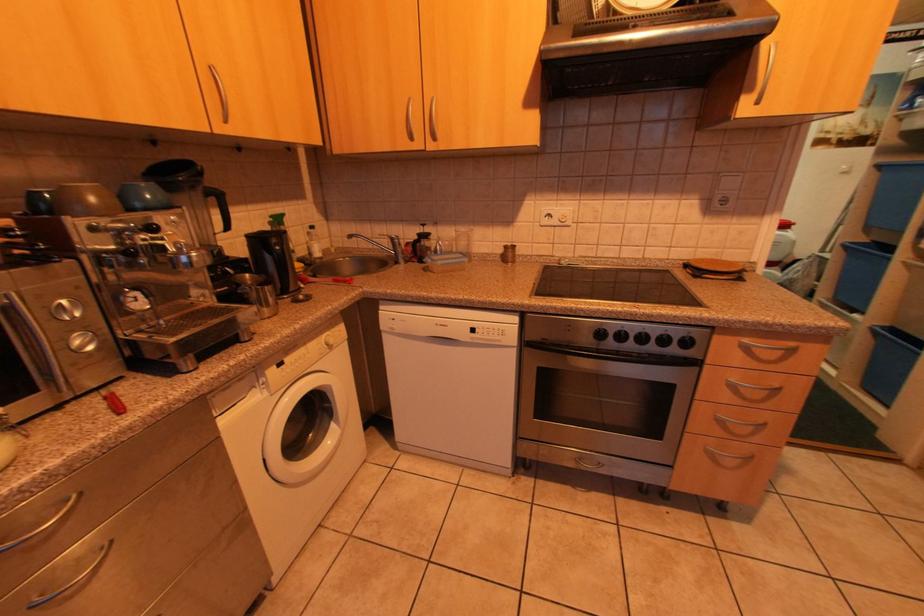
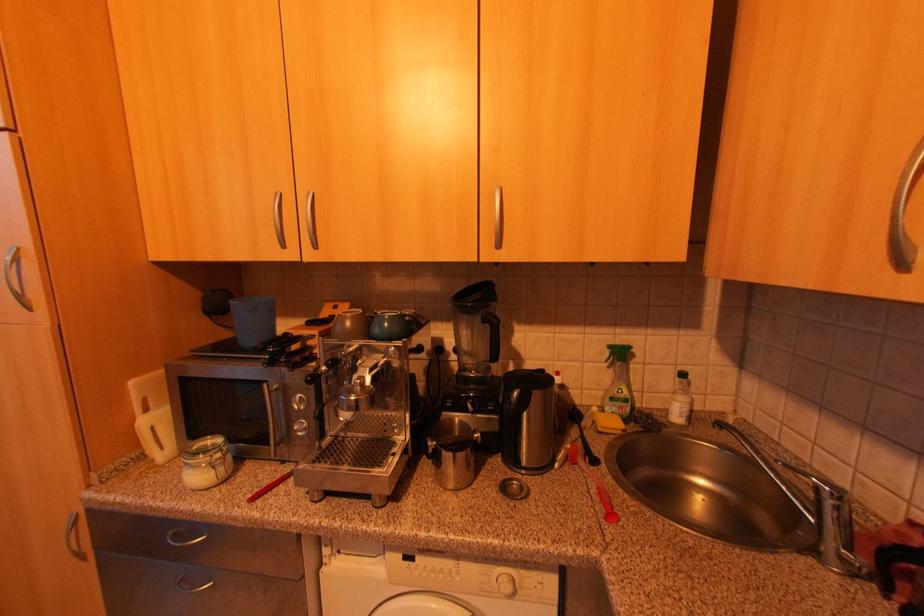
Question: The camera is either moving clockwise (left) or counter-clockwise (right) around the object. The first image is from the beginning of the video and the second image is from the end. Is the camera moving left or right when shooting the video?

Choices:
 (A) Left
 (B) Right

Answer: (B)